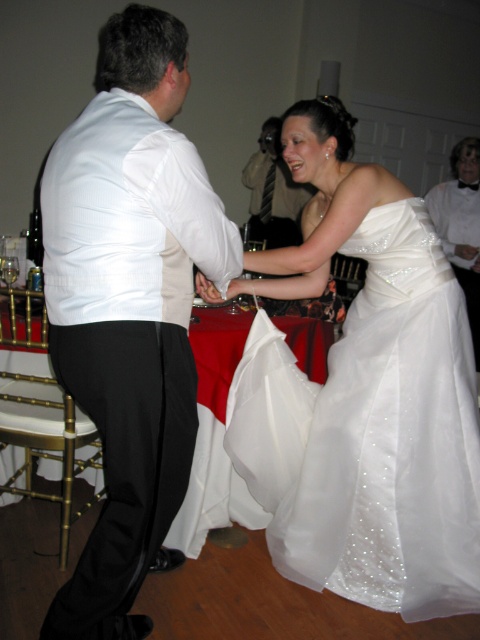
Question: Can you confirm if white satin bow tie at upper right is positioned above matte white shirt at center?

Choices:
 (A) no
 (B) yes

Answer: (A)

Question: Which point is closer to the camera taking this photo?

Choices:
 (A) (447, 237)
 (B) (288, 182)
 (C) (115, 56)
 (D) (408, 257)

Answer: (C)

Question: Where is white satin vest at left located in relation to matte white shirt at center in the image?

Choices:
 (A) below
 (B) above

Answer: (A)

Question: Which object is the farthest from the satin white dress at center?

Choices:
 (A) white satin vest at left
 (B) matte white shirt at center
 (C) white satin bow tie at upper right

Answer: (B)

Question: Is satin white dress at center positioned before matte white shirt at center?

Choices:
 (A) no
 (B) yes

Answer: (B)

Question: Which point is closer to the camera?

Choices:
 (A) (465, 544)
 (B) (478, 342)
 (C) (180, 452)
 (D) (279, 202)

Answer: (C)